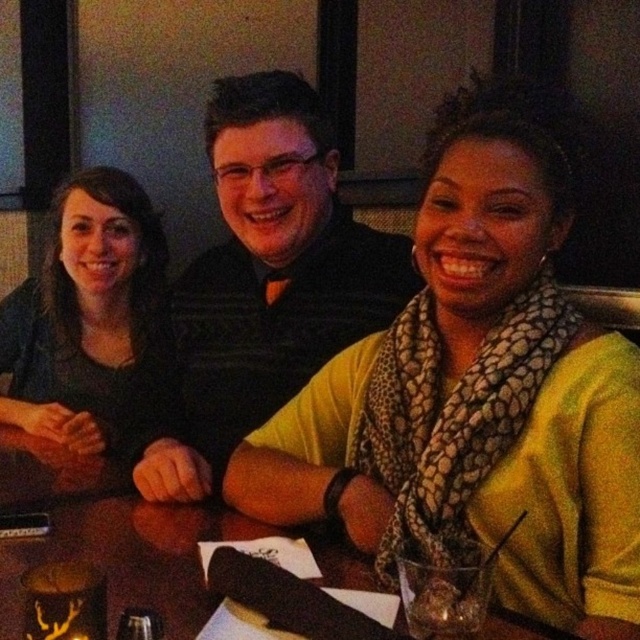
Question: Does yellow matte scarf at center appear over matte black shirt at center?

Choices:
 (A) no
 (B) yes

Answer: (A)

Question: Can you confirm if yellow matte scarf at center is thinner than wooden table at center?

Choices:
 (A) yes
 (B) no

Answer: (A)

Question: Which point is closer to the camera taking this photo?

Choices:
 (A) (113, 192)
 (B) (154, 506)
 (C) (472, 520)
 (D) (208, 285)

Answer: (C)

Question: In this image, where is matte black shirt at center located relative to matte black shirt at left?

Choices:
 (A) left
 (B) right

Answer: (B)

Question: Estimate the real-world distances between objects in this image. Which object is farther from the matte black shirt at center?

Choices:
 (A) matte black shirt at left
 (B) wooden table at center
 (C) yellow matte scarf at center

Answer: (C)

Question: Estimate the real-world distances between objects in this image. Which object is closer to the yellow matte scarf at center?

Choices:
 (A) wooden table at center
 (B) matte black shirt at left
 (C) matte black shirt at center

Answer: (A)